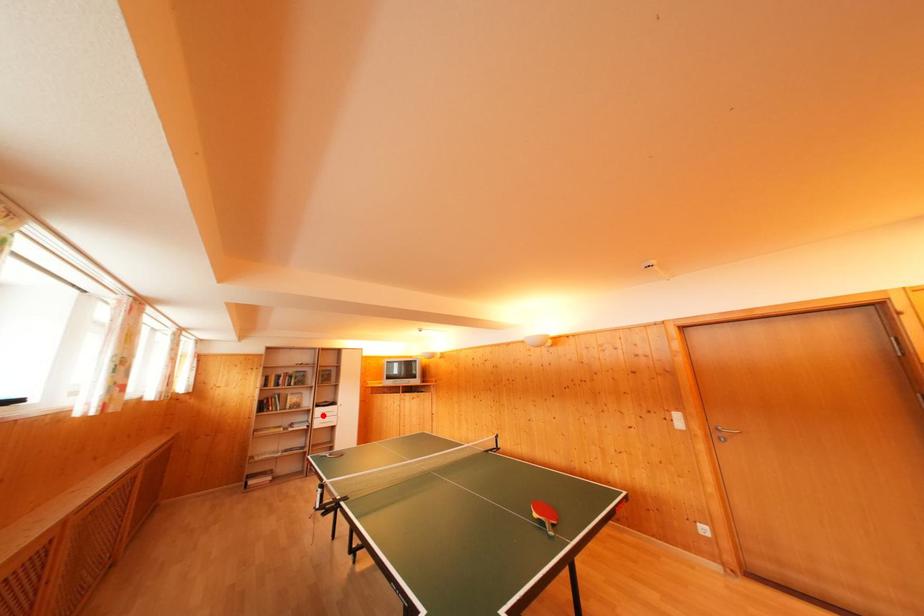
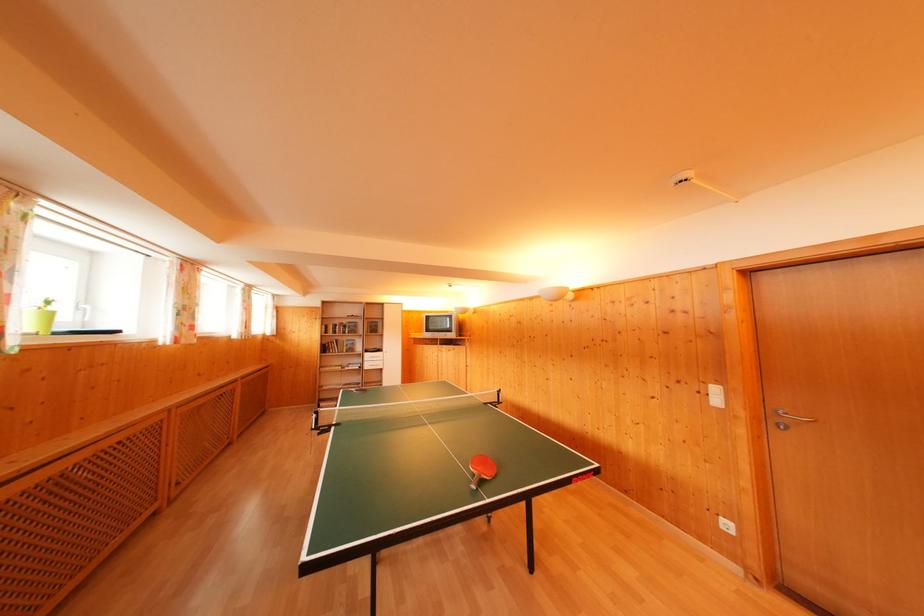
Locate, in the second image, the point that corresponds to the highlighted location in the first image.

(371, 360)